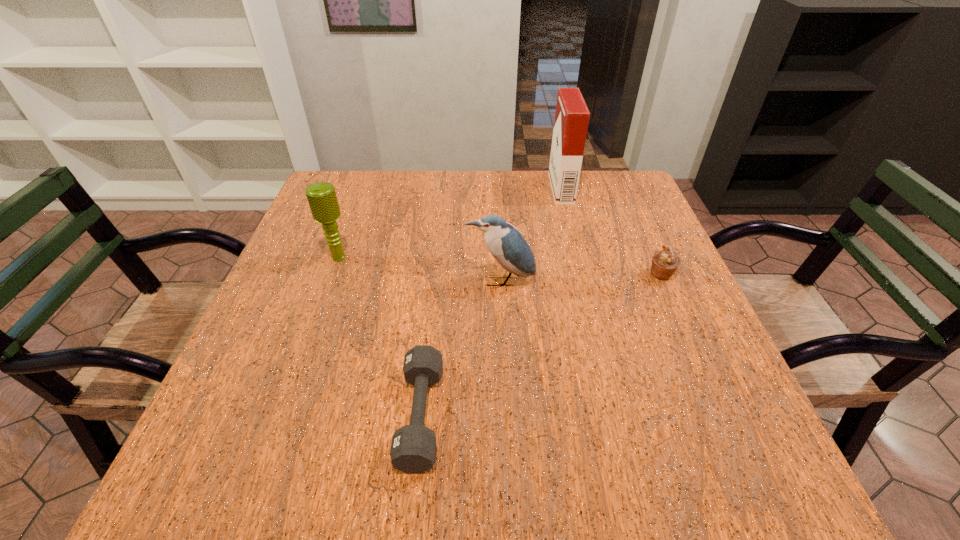
The image size is (960, 540). Identify the location of vacant point at the far edge. (551, 209).

Where is `free space at the near edge of the desktop`? This screenshot has width=960, height=540. free space at the near edge of the desktop is located at coordinates (508, 457).

Where is `vacant space at the left edge of the desktop`? vacant space at the left edge of the desktop is located at coordinates tap(292, 387).

This screenshot has width=960, height=540. I want to click on free region at the right edge, so click(x=628, y=225).

The width and height of the screenshot is (960, 540). I want to click on vacant area at the far left corner, so click(x=341, y=199).

Find the location of a particular element. This screenshot has height=540, width=960. free point at the near left corner is located at coordinates (283, 459).

You are a GUI agent. You are given a task and a screenshot of the screen. Output one action in this format:
    pyautogui.click(x=<x>, y=<y>)
    Task: Click on the vacant region at the far right corner
    The height and width of the screenshot is (540, 960).
    Given the screenshot: What is the action you would take?
    pyautogui.click(x=587, y=204)

Where is `empty space that is in between the fourth tallest object and the third object from left to right`? The width and height of the screenshot is (960, 540). empty space that is in between the fourth tallest object and the third object from left to right is located at coordinates (581, 278).

I want to click on free space between the farthest object and the muffin, so click(612, 232).

The image size is (960, 540). I want to click on free spot between the third object from left to right and the cigarette_case, so click(531, 235).